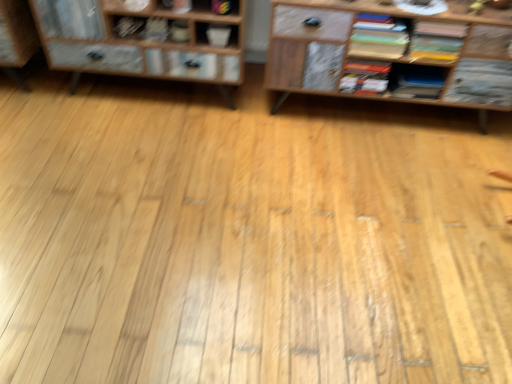
Question: Is the position of matte gray book at upper center, marked as the 2th book in a left-to-right arrangement, more distant than that of matte black book at upper left, placed as the first book when sorted from left to right?

Choices:
 (A) no
 (B) yes

Answer: (B)

Question: Can you confirm if matte gray book at upper center, marked as the 2th book in a left-to-right arrangement, is shorter than matte black book at upper left, which appears as the sixth book when viewed from the right?

Choices:
 (A) no
 (B) yes

Answer: (A)

Question: From the image's perspective, does matte gray book at upper center, marked as the 2th book in a left-to-right arrangement, appear lower than matte black book at upper left, placed as the first book when sorted from left to right?

Choices:
 (A) no
 (B) yes

Answer: (A)

Question: Is matte gray book at upper center, marked as the 2th book in a left-to-right arrangement, surrounding matte black book at upper left, placed as the first book when sorted from left to right?

Choices:
 (A) yes
 (B) no

Answer: (B)

Question: From a real-world perspective, does matte gray book at upper center, marked as the 2th book in a left-to-right arrangement, stand above matte black book at upper left, placed as the first book when sorted from left to right?

Choices:
 (A) no
 (B) yes

Answer: (B)

Question: Relative to matte yellow book at upper right, the 1th book from the right, is wooden cabinet at left in front or behind?

Choices:
 (A) behind
 (B) front

Answer: (B)

Question: Considering the positions of wooden cabinet at left and matte yellow book at upper right, the 1th book from the right, in the image, is wooden cabinet at left taller or shorter than matte yellow book at upper right, the 1th book from the right,?

Choices:
 (A) tall
 (B) short

Answer: (A)

Question: In terms of width, does wooden cabinet at left look wider or thinner when compared to matte yellow book at upper right, marked as the sixth book in a left-to-right arrangement?

Choices:
 (A) thin
 (B) wide

Answer: (B)

Question: From the image's perspective, is wooden cabinet at left positioned above or below matte yellow book at upper right, marked as the sixth book in a left-to-right arrangement?

Choices:
 (A) above
 (B) below

Answer: (A)

Question: Visually, is matte gray book at upper center, marked as the 2th book in a left-to-right arrangement, positioned to the left or to the right of matte yellow book at upper right, the 1th book from the right?

Choices:
 (A) right
 (B) left

Answer: (B)

Question: Which is correct: matte gray book at upper center, marked as the 5th book in a right-to-left arrangement, is inside matte yellow book at upper right, the 1th book from the right, or outside of it?

Choices:
 (A) outside
 (B) inside

Answer: (A)

Question: Considering the positions of matte gray book at upper center, marked as the 2th book in a left-to-right arrangement, and matte yellow book at upper right, marked as the sixth book in a left-to-right arrangement, in the image, is matte gray book at upper center, marked as the 2th book in a left-to-right arrangement, wider or thinner than matte yellow book at upper right, marked as the sixth book in a left-to-right arrangement,?

Choices:
 (A) wide
 (B) thin

Answer: (B)

Question: Is point (144, 34) closer or farther from the camera than point (444, 29)?

Choices:
 (A) farther
 (B) closer

Answer: (A)

Question: In terms of height, does matte black book at upper left, placed as the first book when sorted from left to right, look taller or shorter compared to multicolored paper stack at upper right, the 3th book from the right?

Choices:
 (A) tall
 (B) short

Answer: (B)

Question: From the image's perspective, is matte black book at upper left, which appears as the sixth book when viewed from the right, above or below multicolored paper stack at upper right, the 4th book from the left?

Choices:
 (A) above
 (B) below

Answer: (A)